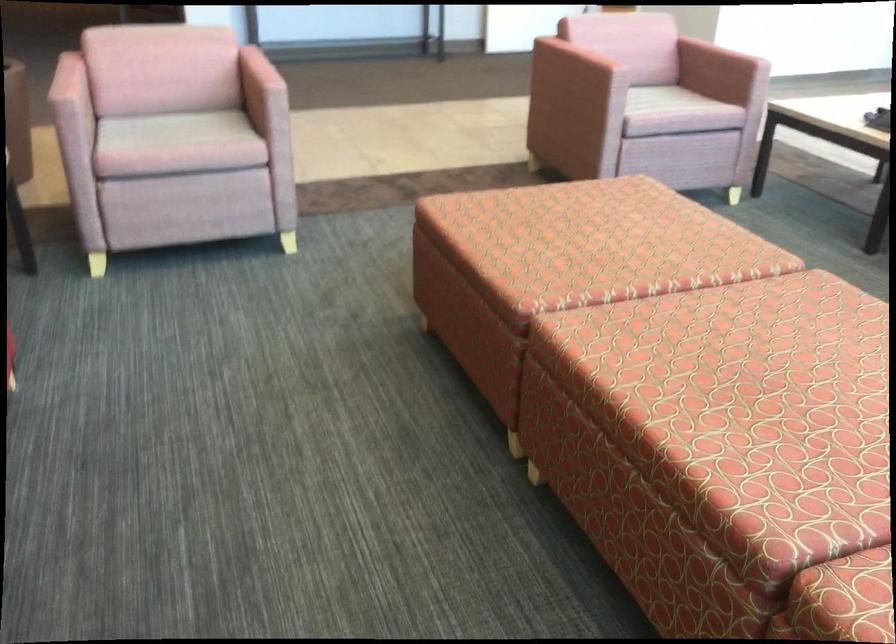
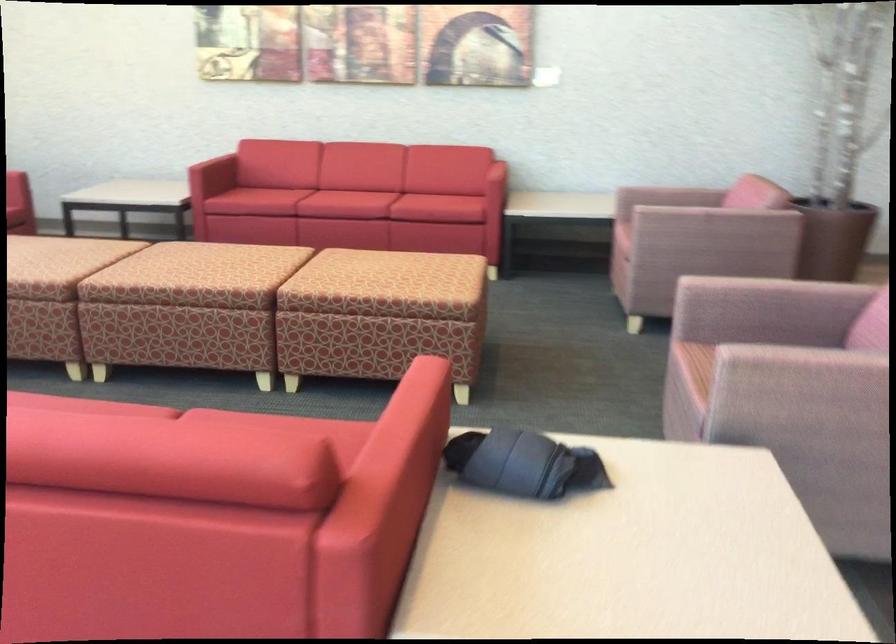
The point at (x=165, y=149) is marked in the first image. Where is the corresponding point in the second image?

(624, 218)